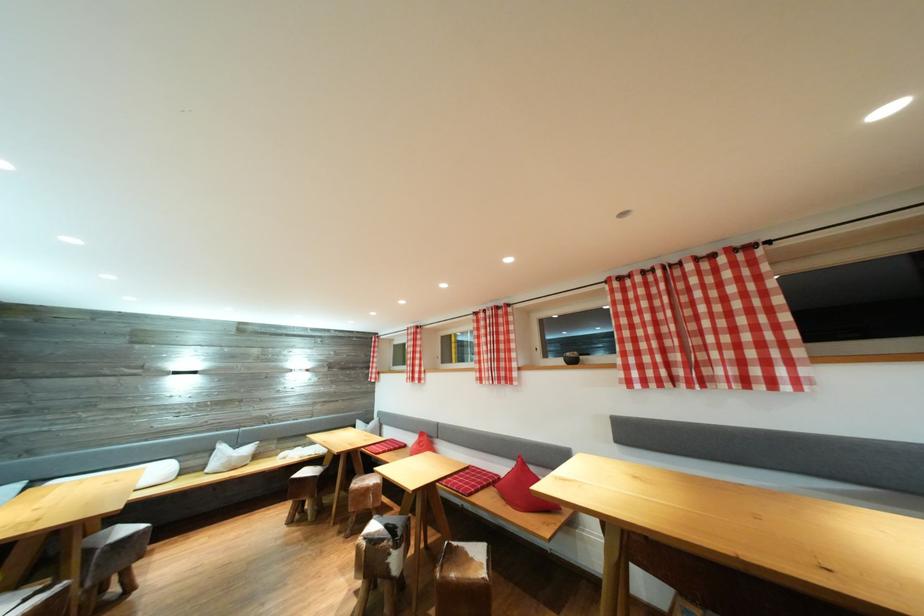
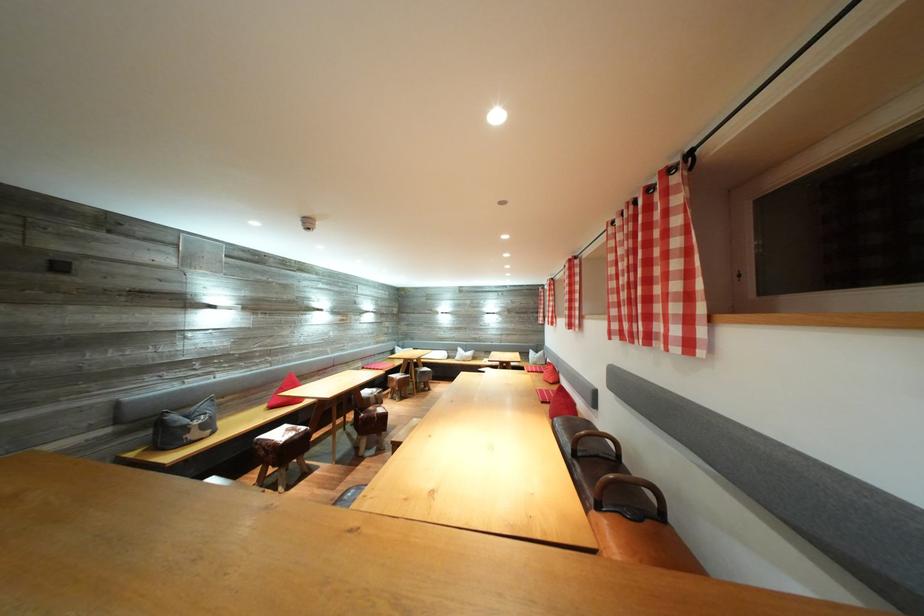
Where in the second image is the point corresponding to pixel 399 336 from the first image?

(553, 288)